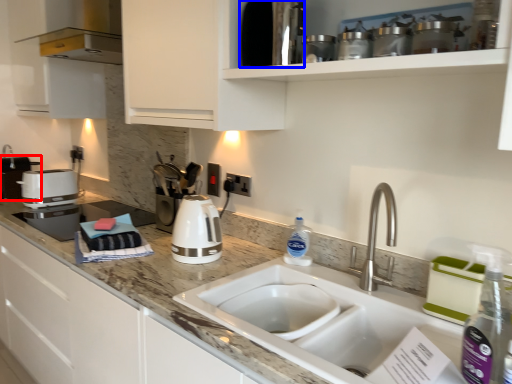
Question: Among these objects, which one is nearest to the camera, appliance (highlighted by a red box) or appliance (highlighted by a blue box)?

Choices:
 (A) appliance
 (B) appliance

Answer: (B)